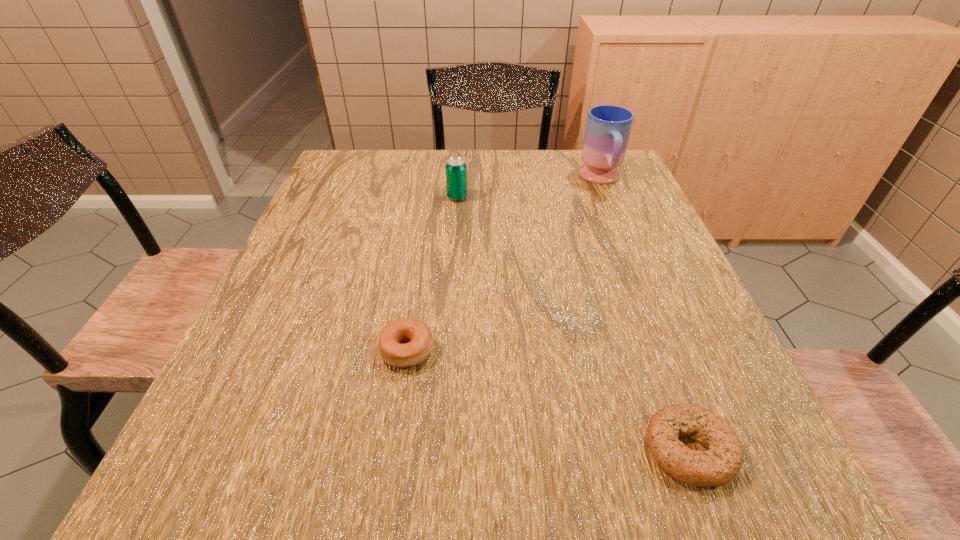
Find the location of a particular element. object that is at the far edge is located at coordinates (608, 127).

This screenshot has height=540, width=960. Identify the location of object located in the near edge section of the desktop. (719, 465).

The image size is (960, 540). In order to click on mug that is at the right edge in this screenshot , I will do `click(608, 127)`.

Locate an element on the screen. bagel at the right edge is located at coordinates (719, 465).

Find the location of a particular element. The width and height of the screenshot is (960, 540). object at the far right corner is located at coordinates (608, 127).

What are the coordinates of `object that is at the near right corner` in the screenshot? It's located at [719, 465].

Identify the location of vacant area at the far edge of the desktop. This screenshot has height=540, width=960. (570, 174).

Find the location of `free space at the near edge of the desktop`. free space at the near edge of the desktop is located at coordinates (500, 467).

Image resolution: width=960 pixels, height=540 pixels. I want to click on vacant area at the left edge of the desktop, so click(x=298, y=228).

What are the coordinates of `free region at the right edge` in the screenshot? It's located at (675, 255).